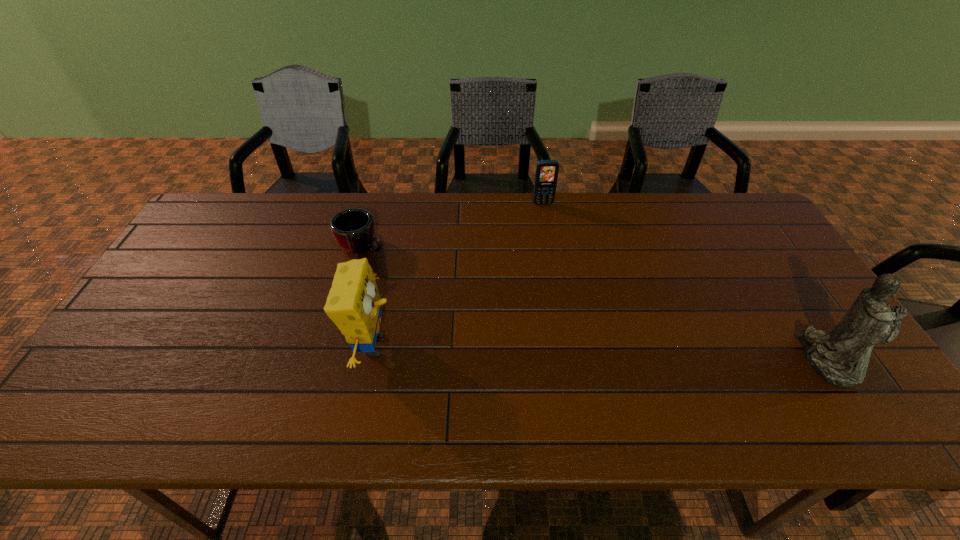
Identify the location of sponge. (354, 305).

Where is `the rightmost object`? the rightmost object is located at coordinates (841, 357).

You are a GUI agent. You are given a task and a screenshot of the screen. Output one action in this format:
    pyautogui.click(x=<x>, y=<y>)
    Task: Click on the figurine
    Image resolution: width=960 pixels, height=540 pixels.
    Given the screenshot: What is the action you would take?
    pos(841,357)

Find the location of `mug`. mug is located at coordinates (353, 229).

Image resolution: width=960 pixels, height=540 pixels. Identify the location of the third nearest object. (353, 229).

The image size is (960, 540). I want to click on cellular telephone, so click(546, 175).

Where is `the farthest object`? The height and width of the screenshot is (540, 960). the farthest object is located at coordinates (546, 175).

This screenshot has width=960, height=540. I want to click on vacant space located on the face of the second tallest object, so click(420, 345).

Identify the location of vacant area located 0.170m on the side of the third nearest object with the handle. tap(424, 276).

Locate an element on the screen. Image resolution: width=960 pixels, height=540 pixels. blank area located on the side of the third nearest object with the handle is located at coordinates (464, 298).